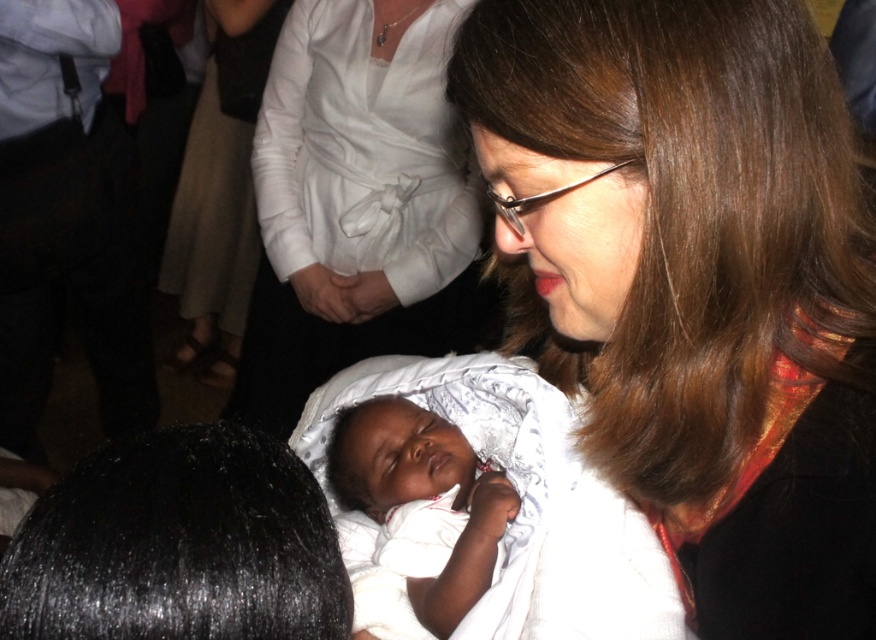
You are a photographer setting up for a family portrait. You need to ensure that the smooth brown hair at center and the white satin dress at center are both in focus. Given that your camera has a depth of field of 36 inches, will both subjects be in focus?

The distance between the smooth brown hair at center and the white satin dress at center is 38.55 inches, which exceeds the camera depth of field of 36 inches. Therefore, both subjects cannot be in focus simultaneously.